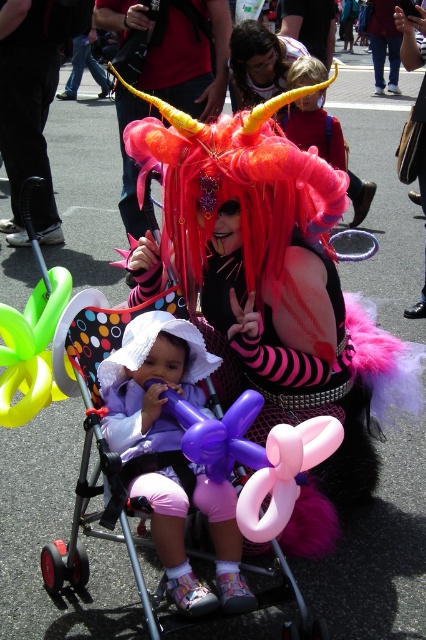
In the scene shown: You are a photographer at the event and want to capture a clear shot of the shiny pink wig at center and the fluffy pink wig at center. Which wig should you focus on if you want the one that is closer to the camera?

The shiny pink wig at center is positioned under the fluffy pink wig at center, so the fluffy pink wig at center is closer to the camera and should be focused on.

You are at the parade and notice the pink rubber balloon at center and the fluffy pink wig at center. Which one is positioned lower in the image?

The pink rubber balloon at center is located below the fluffy pink wig at center, so the pink rubber balloon at center is positioned lower in the image.